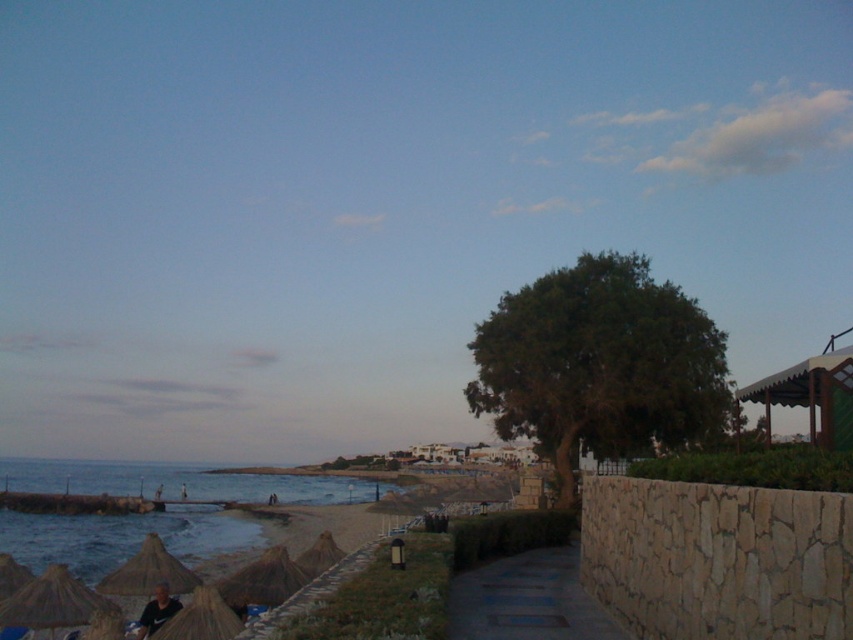
Who is positioned more to the right, green leafy tree at center-right or blue stone path at center?

green leafy tree at center-right is more to the right.

Which is above, green leafy tree at center-right or blue stone path at center?

Positioned higher is green leafy tree at center-right.

Between point (714, 410) and point (515, 604), which one is positioned behind?

The point (714, 410) is more distant.

Identify the location of green leafy tree at center-right. (598, 364).

Is blue stone path at center in front of brown wooden hut at right?

Yes.

Between blue stone path at center and brown wooden hut at right, which one appears on the left side from the viewer's perspective?

blue stone path at center

Is point (541, 595) more distant than point (846, 412)?

Yes.

Image resolution: width=853 pixels, height=640 pixels. In order to click on blue stone path at center in this screenshot , I will do `click(527, 600)`.

Is green leafy tree at center-right smaller than brown wooden hut at right?

Indeed, green leafy tree at center-right has a smaller size compared to brown wooden hut at right.

Locate an element on the screen. The width and height of the screenshot is (853, 640). green leafy tree at center-right is located at coordinates (598, 364).

Where is `green leafy tree at center-right`? The width and height of the screenshot is (853, 640). green leafy tree at center-right is located at coordinates (598, 364).